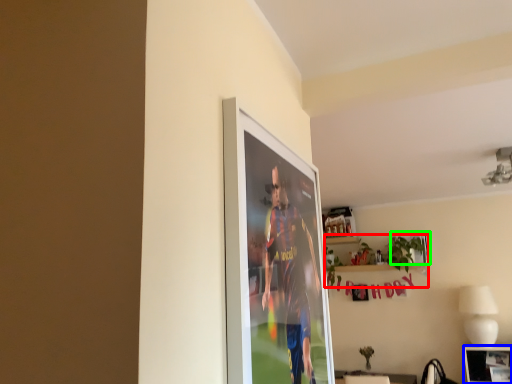
Question: Estimate the real-world distances between objects in this image. Which object is closer to houseplant (highlighted by a red box), picture frame (highlighted by a blue box) or picture frame (highlighted by a green box)?

Choices:
 (A) picture frame
 (B) picture frame

Answer: (B)